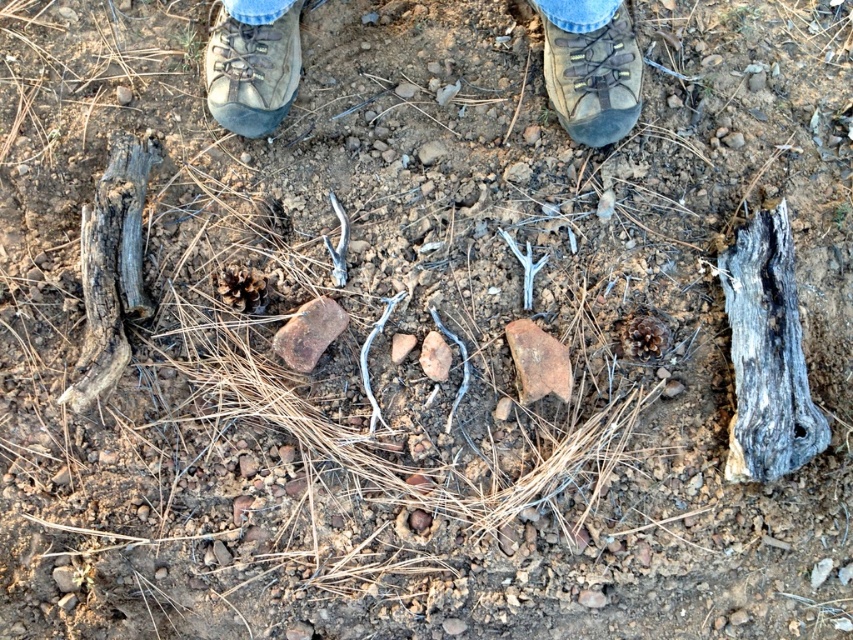
Question: Which point is closer to the camera?

Choices:
 (A) brown leather boot at upper center
 (B) gray weathered log at right
 (C) brown leather shoe at upper center
 (D) gray weathered log at left

Answer: (B)

Question: Can you confirm if brown leather boots at center is bigger than gray weathered log at left?

Choices:
 (A) yes
 (B) no

Answer: (B)

Question: Which point is closer to the camera taking this photo?

Choices:
 (A) (235, 120)
 (B) (216, 100)

Answer: (B)

Question: From the image, what is the correct spatial relationship of gray weathered log at left in relation to brown leather shoe at upper center?

Choices:
 (A) below
 (B) above

Answer: (A)

Question: Is gray weathered log at right to the left of jeans at center from the viewer's perspective?

Choices:
 (A) no
 (B) yes

Answer: (A)

Question: Which object is the closest to the brown leather shoe at upper center?

Choices:
 (A) brown leather boot at upper center
 (B) gray weathered log at left
 (C) brown leather boots at center

Answer: (B)